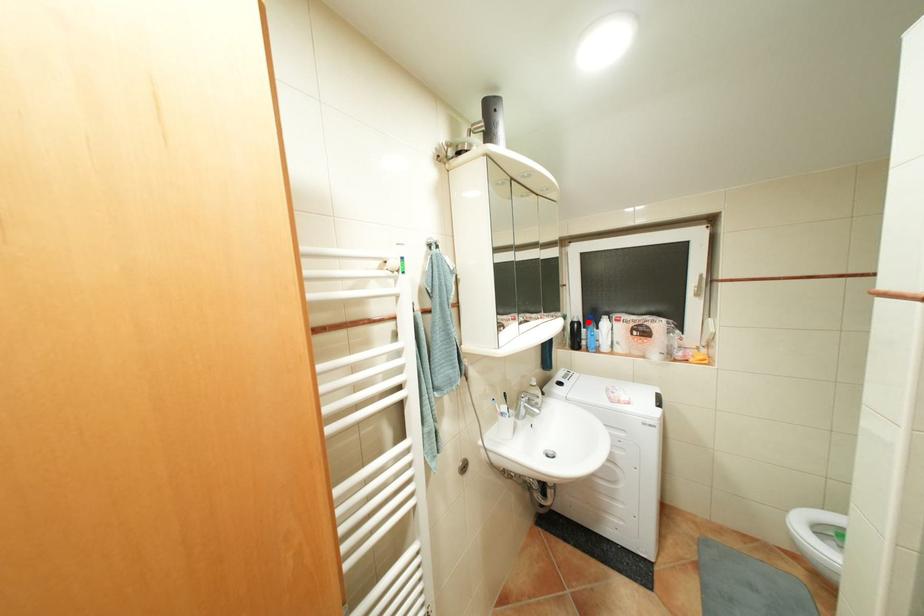
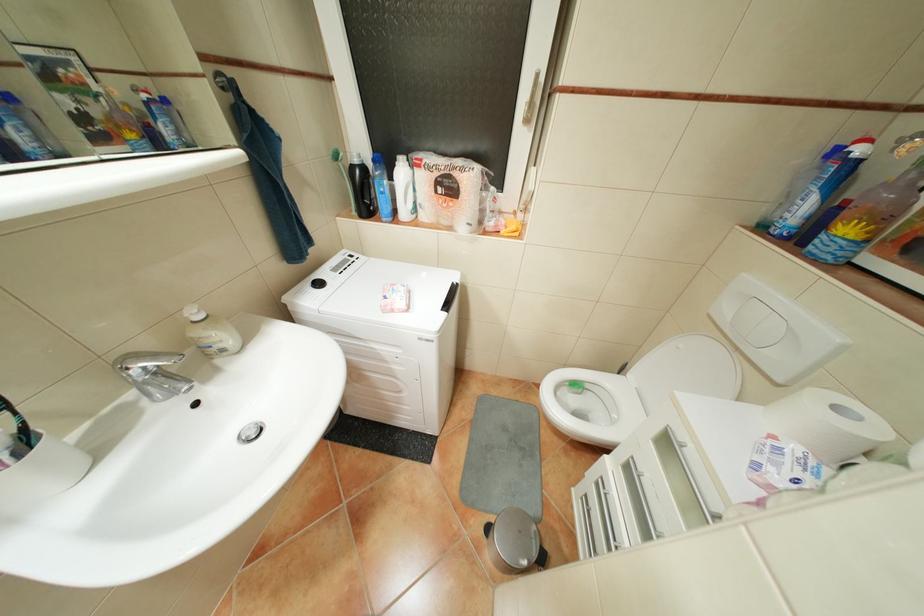
In the second image, find the point that corresponds to the highlighted location in the first image.

(373, 167)